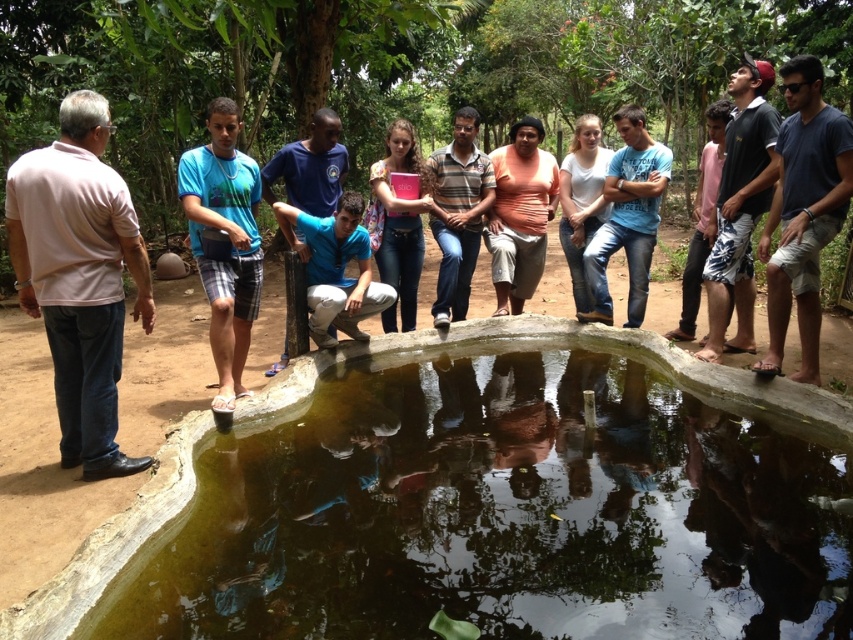
Is blue jeans at center in front of blue cotton shirt at center?

That is False.

Image resolution: width=853 pixels, height=640 pixels. Find the location of `blue jeans at center`. blue jeans at center is located at coordinates (628, 216).

The image size is (853, 640). What are the coordinates of `blue jeans at center` in the screenshot? It's located at (628, 216).

Locate an element on the screen. blue jeans at center is located at coordinates pos(628,216).

Where is `pink cotton shirt at left`? pink cotton shirt at left is located at coordinates (79, 276).

Is pink cotton shirt at left shorter than blue plaid shorts at center?

In fact, pink cotton shirt at left may be taller than blue plaid shorts at center.

At what (x,y) coordinates should I click in order to perform the action: click on pink cotton shirt at left. Please return your answer as a coordinate pair (x, y). The image size is (853, 640). Looking at the image, I should click on (79, 276).

Can you confirm if blue plaid shorts at center is positioned to the right of striped cotton shirt at center?

In fact, blue plaid shorts at center is to the left of striped cotton shirt at center.

Which is more to the left, blue plaid shorts at center or striped cotton shirt at center?

blue plaid shorts at center is more to the left.

Who is more distant from viewer, (248, 228) or (460, 228)?

Positioned behind is point (460, 228).

At what (x,y) coordinates should I click in order to perform the action: click on blue plaid shorts at center. Please return your answer as a coordinate pair (x, y). The height and width of the screenshot is (640, 853). Looking at the image, I should click on (227, 237).